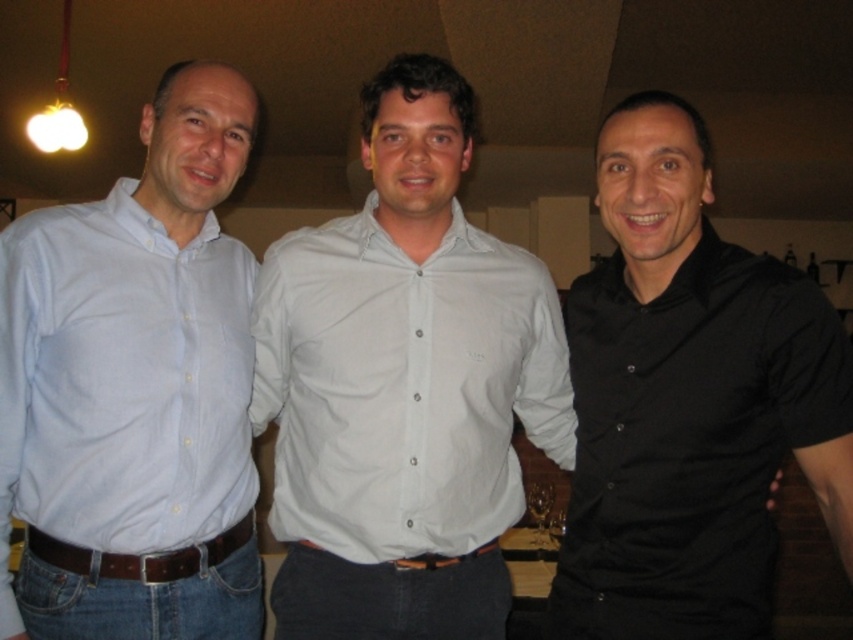
Question: Which is farther from the white cotton shirt at center?

Choices:
 (A) brown leather belt at lower center
 (B) light blue shirt at left

Answer: (A)

Question: Is black matte shirt at right thinner than brown leather belt at lower center?

Choices:
 (A) yes
 (B) no

Answer: (B)

Question: Observing the image, what is the correct spatial positioning of light blue shirt at left in reference to brown leather belt at lower center?

Choices:
 (A) right
 (B) left

Answer: (B)

Question: Which object is the closest to the white cotton shirt at center?

Choices:
 (A) black matte shirt at right
 (B) light blue shirt at left
 (C) brown leather belt at center
 (D) brown leather belt at lower center

Answer: (B)

Question: Considering the real-world distances, which object is closest to the brown leather belt at center?

Choices:
 (A) white cotton shirt at center
 (B) brown leather belt at lower center
 (C) black matte shirt at right

Answer: (B)

Question: In this image, where is light blue shirt at left located relative to white cotton shirt at center?

Choices:
 (A) right
 (B) left

Answer: (B)